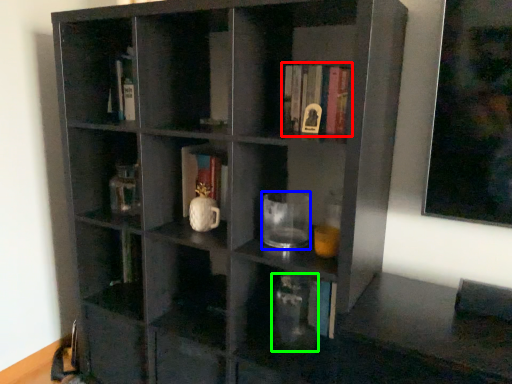
Question: Considering the real-world distances, which object is closest to book (highlighted by a red box)? mug (highlighted by a blue box) or glass vase (highlighted by a green box).

Choices:
 (A) mug
 (B) glass vase

Answer: (A)